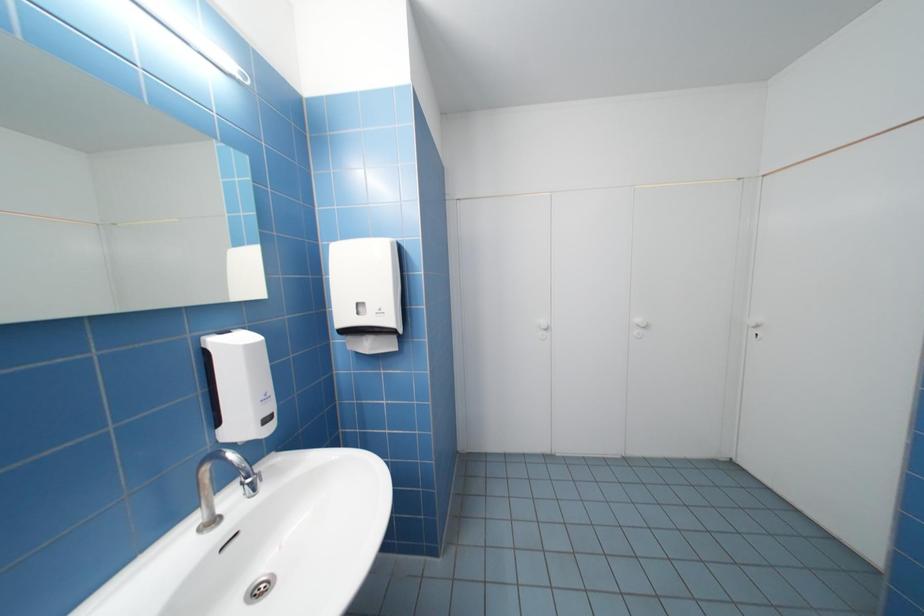
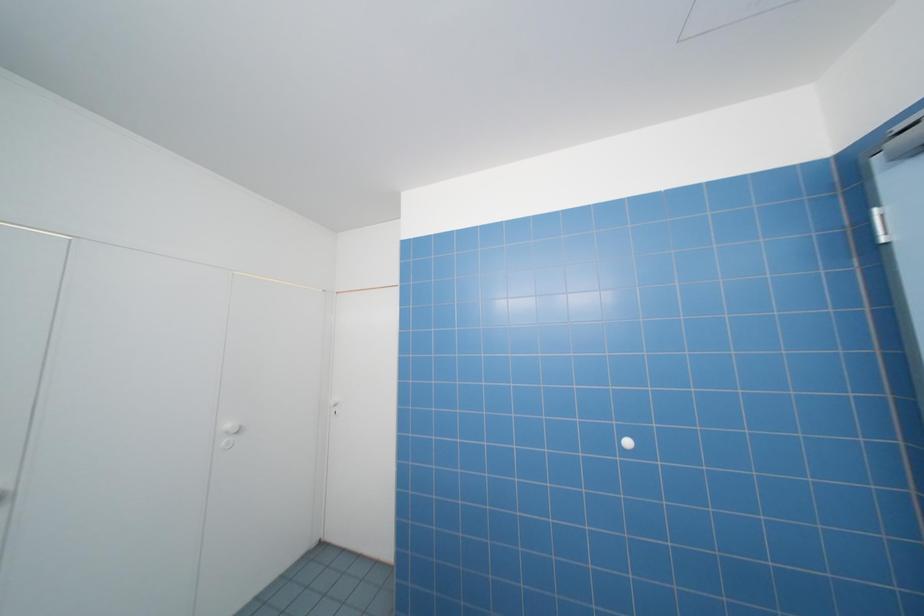
Question: The camera is either moving clockwise (left) or counter-clockwise (right) around the object. The first image is from the beginning of the video and the second image is from the end. Is the camera moving left or right when shooting the video?

Choices:
 (A) Left
 (B) Right

Answer: (A)